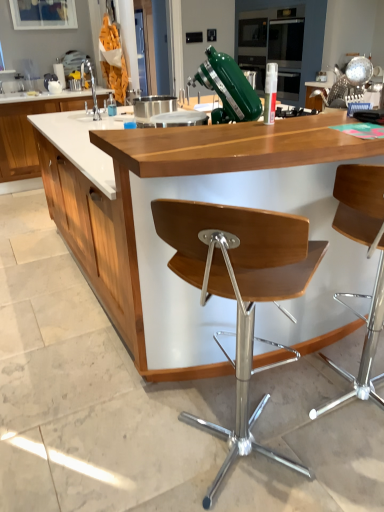
Question: Is wooden seat at center, acting as the 2th chair starting from the left, behind brushed metal sink at left?

Choices:
 (A) no
 (B) yes

Answer: (A)

Question: Is wooden seat at center, acting as the 2th chair starting from the left, located outside brushed metal sink at left?

Choices:
 (A) yes
 (B) no

Answer: (A)

Question: Considering the relative sizes of wooden seat at center, the 1th chair viewed from the right, and brushed metal sink at left in the image provided, is wooden seat at center, the 1th chair viewed from the right, shorter than brushed metal sink at left?

Choices:
 (A) no
 (B) yes

Answer: (A)

Question: Is wooden seat at center, the 1th chair viewed from the right, aimed at brushed metal sink at left?

Choices:
 (A) yes
 (B) no

Answer: (B)

Question: Considering the relative sizes of wooden seat at center, acting as the 2th chair starting from the left, and brushed metal sink at left in the image provided, is wooden seat at center, acting as the 2th chair starting from the left, taller than brushed metal sink at left?

Choices:
 (A) no
 (B) yes

Answer: (B)

Question: Is wooden seat at center, the 1th chair viewed from the right, to the right of brushed metal sink at left from the viewer's perspective?

Choices:
 (A) no
 (B) yes

Answer: (B)

Question: From the image's perspective, does wooden chair at center, the 1th chair in the left-to-right sequence, appear lower than wooden counter at center, acting as the first countertop starting from the bottom?

Choices:
 (A) yes
 (B) no

Answer: (A)

Question: From a real-world perspective, is wooden chair at center, which is the second chair from right to left, positioned under wooden counter at center, which is the 1th countertop in right-to-left order, based on gravity?

Choices:
 (A) no
 (B) yes

Answer: (B)

Question: Is wooden chair at center, which is the second chair from right to left, further to the viewer compared to wooden counter at center, placed as the 2th countertop when sorted from back to front?

Choices:
 (A) yes
 (B) no

Answer: (B)

Question: Does wooden chair at center, the 1th chair in the left-to-right sequence, have a lesser height compared to wooden counter at center, acting as the first countertop starting from the bottom?

Choices:
 (A) yes
 (B) no

Answer: (A)

Question: From a real-world perspective, is wooden chair at center, which is the second chair from right to left, on wooden counter at center, the 1th countertop viewed from the front?

Choices:
 (A) no
 (B) yes

Answer: (A)

Question: Is wooden chair at center, which is the second chair from right to left, bigger than wooden counter at center, which is the 2th countertop from left to right?

Choices:
 (A) yes
 (B) no

Answer: (B)

Question: Considering the relative sizes of brushed metal sink at left and white wood cabinet at left in the image provided, is brushed metal sink at left taller than white wood cabinet at left?

Choices:
 (A) no
 (B) yes

Answer: (A)